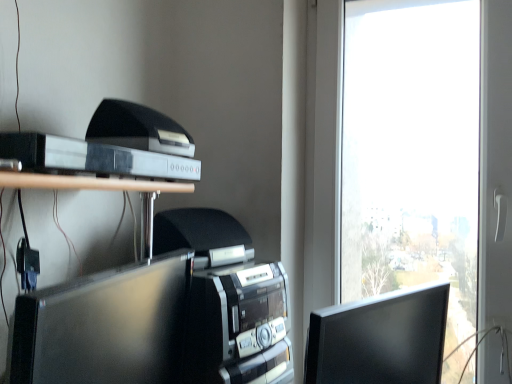
Question: Does matte black monitor at right, the first computer monitor positioned from the right, appear on the right side of matte black monitor at center, marked as the second computer monitor in a right-to-left arrangement?

Choices:
 (A) yes
 (B) no

Answer: (A)

Question: Is matte black monitor at right, the first computer monitor positioned from the right, not close to matte black monitor at center, which appears as the first computer monitor when viewed from the left?

Choices:
 (A) no
 (B) yes

Answer: (A)

Question: Is the position of matte black monitor at right, which is the 2th computer monitor from left to right, less distant than that of matte black monitor at center, marked as the second computer monitor in a right-to-left arrangement?

Choices:
 (A) yes
 (B) no

Answer: (B)

Question: Is matte black monitor at right, which is the 2th computer monitor from left to right, bigger than matte black monitor at center, which appears as the first computer monitor when viewed from the left?

Choices:
 (A) yes
 (B) no

Answer: (B)

Question: From a real-world perspective, does matte black monitor at right, which is the 2th computer monitor from left to right, sit lower than matte black monitor at center, marked as the second computer monitor in a right-to-left arrangement?

Choices:
 (A) no
 (B) yes

Answer: (B)

Question: Is matte black monitor at right, which is the 2th computer monitor from left to right, further to camera compared to matte black monitor at center, marked as the second computer monitor in a right-to-left arrangement?

Choices:
 (A) yes
 (B) no

Answer: (A)

Question: Considering the relative sizes of matte black monitor at center, marked as the second computer monitor in a right-to-left arrangement, and black plastic printer at upper left in the image provided, is matte black monitor at center, marked as the second computer monitor in a right-to-left arrangement, taller than black plastic printer at upper left?

Choices:
 (A) no
 (B) yes

Answer: (B)

Question: Could you tell me if matte black monitor at center, marked as the second computer monitor in a right-to-left arrangement, is facing black plastic printer at upper left?

Choices:
 (A) no
 (B) yes

Answer: (A)

Question: Considering the relative sizes of matte black monitor at center, which appears as the first computer monitor when viewed from the left, and black plastic printer at upper left in the image provided, is matte black monitor at center, which appears as the first computer monitor when viewed from the left, thinner than black plastic printer at upper left?

Choices:
 (A) yes
 (B) no

Answer: (B)

Question: Considering the relative sizes of matte black monitor at center, which appears as the first computer monitor when viewed from the left, and black plastic printer at upper left in the image provided, is matte black monitor at center, which appears as the first computer monitor when viewed from the left, shorter than black plastic printer at upper left?

Choices:
 (A) no
 (B) yes

Answer: (A)

Question: Is matte black monitor at center, which appears as the first computer monitor when viewed from the left, closer to camera compared to black plastic printer at upper left?

Choices:
 (A) yes
 (B) no

Answer: (A)

Question: Is matte black monitor at center, which appears as the first computer monitor when viewed from the left, not near black plastic printer at upper left?

Choices:
 (A) yes
 (B) no

Answer: (B)

Question: From the image's perspective, is matte black monitor at right, which is the 2th computer monitor from left to right, under black plastic printer at upper left?

Choices:
 (A) no
 (B) yes

Answer: (B)